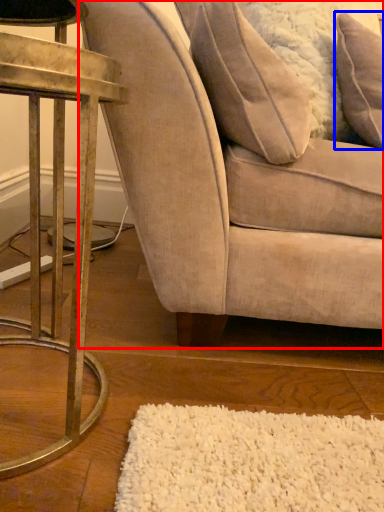
Question: Which object is further to the camera taking this photo, chair (highlighted by a red box) or pillow (highlighted by a blue box)?

Choices:
 (A) chair
 (B) pillow

Answer: (B)